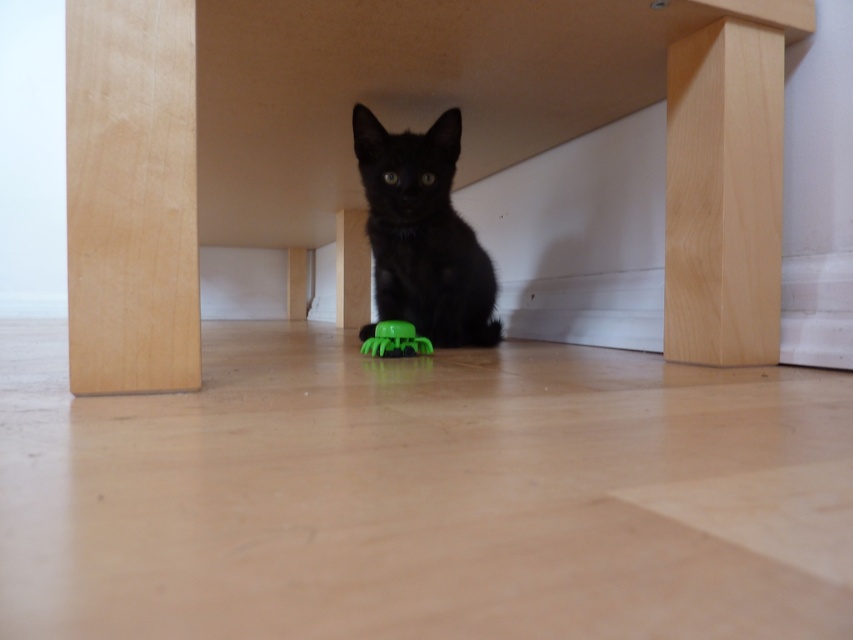
Question: Can you confirm if beech wood table at center is positioned to the left of green rubber toy at center?

Choices:
 (A) yes
 (B) no

Answer: (A)

Question: Is beech wood table at center thinner than green rubber toy at center?

Choices:
 (A) yes
 (B) no

Answer: (B)

Question: Is black matte cat at center to the left of green rubber toy at center from the viewer's perspective?

Choices:
 (A) no
 (B) yes

Answer: (A)

Question: Which object is closer to the camera taking this photo?

Choices:
 (A) green rubber toy at center
 (B) black matte cat at center
 (C) beech wood table at center

Answer: (C)

Question: Estimate the real-world distances between objects in this image. Which object is farther from the green rubber toy at center?

Choices:
 (A) beech wood table at center
 (B) black matte cat at center

Answer: (A)

Question: Which point is closer to the camera?

Choices:
 (A) beech wood table at center
 (B) black matte cat at center

Answer: (A)